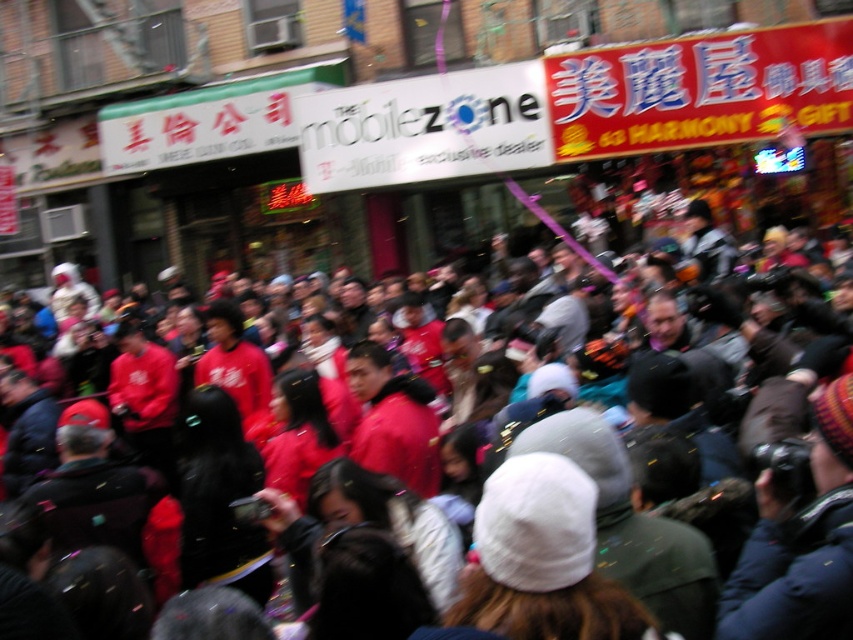
You are a photographer standing in the crowd and want to capture the white matte sign at center and the knitted wool hat at center in the same frame. Based on their positions, which object should you focus on first to ensure both are in the frame?

The white matte sign at center is located above the knitted wool hat at center, so you should focus on the knitted wool hat at center first to ensure both are in the frame.

You are a photographer trying to capture the crowd in the center of the street. You notice the red matte jackets at center. Based on their position, where should you aim your camera to ensure they are in the frame?

The red matte jackets at center are located at point (780,396), so you should aim your camera towards the lower right of the frame to capture them.

Based on the photo, you are a photographer standing in the crowd and want to take a clear picture of the knitted wool hat at center without the white matte sign at center blocking it. Which direction should you move to achieve this?

The knitted wool hat at center is behind the white matte sign at center. To take a clear picture of the knitted wool hat at center without the white matte sign at center blocking it, you should move to the side so that the white matte sign at center is no longer in front of the knitted wool hat at center.